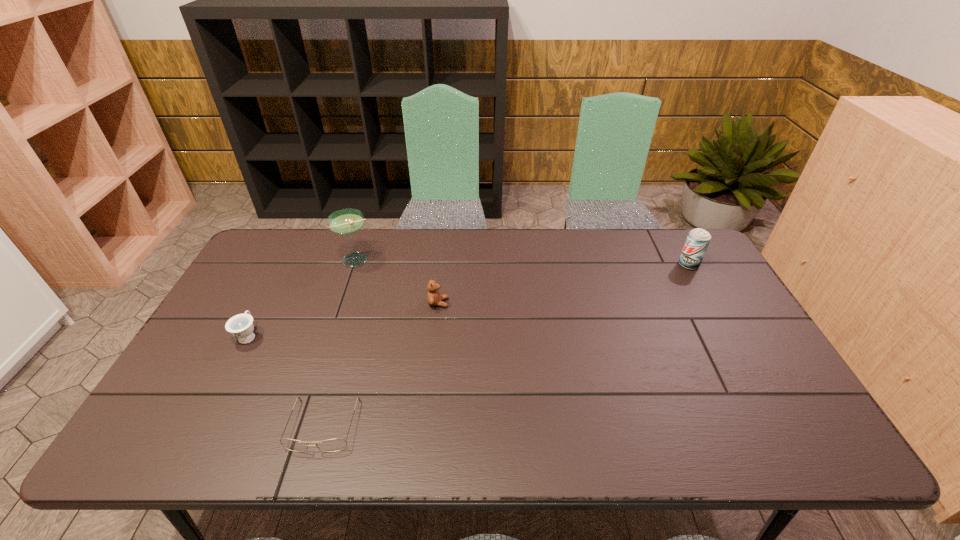
Locate an element on the screen. This screenshot has width=960, height=540. object located in the far right corner section of the desktop is located at coordinates (698, 239).

In order to click on free region at the far edge of the desktop in this screenshot , I will do `click(392, 232)`.

Where is `free space at the near edge of the desktop`? free space at the near edge of the desktop is located at coordinates (382, 444).

Where is `vacant space at the left edge`? The image size is (960, 540). vacant space at the left edge is located at coordinates (209, 394).

You are a GUI agent. You are given a task and a screenshot of the screen. Output one action in this format:
    pyautogui.click(x=<x>, y=<y>)
    Task: Click on the free space at the far left corner of the desktop
    The height and width of the screenshot is (540, 960).
    Given the screenshot: What is the action you would take?
    pyautogui.click(x=276, y=244)

In the image, there is a desktop. Where is `vacant space at the near left corner`? The height and width of the screenshot is (540, 960). vacant space at the near left corner is located at coordinates (202, 428).

I want to click on vacant region at the far right corner of the desktop, so click(655, 245).

The width and height of the screenshot is (960, 540). I want to click on empty space between the second nearest object and the nearest object, so click(286, 380).

Locate an element on the screen. This screenshot has width=960, height=540. free space between the beer can and the leftmost object is located at coordinates (468, 300).

You are a GUI agent. You are given a task and a screenshot of the screen. Output one action in this format:
    pyautogui.click(x=<x>, y=<y>)
    Task: Click on the free space between the fourth object from left to right and the beer can
    This screenshot has width=960, height=540.
    Given the screenshot: What is the action you would take?
    pyautogui.click(x=564, y=284)